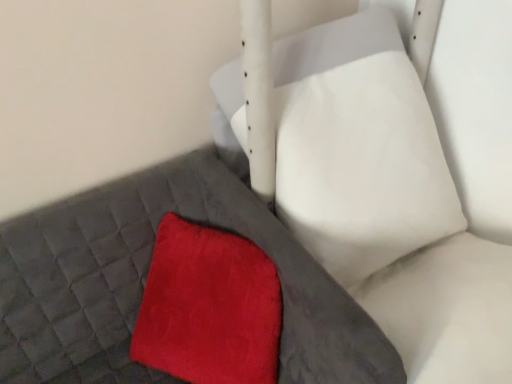
Question: Looking at their shapes, would you say matte gray bed frame at lower left is wider or thinner than velvet red cushion at center?

Choices:
 (A) wide
 (B) thin

Answer: (B)

Question: Based on their positions, is matte gray bed frame at lower left located to the left or right of velvet red cushion at center?

Choices:
 (A) right
 (B) left

Answer: (B)

Question: Considering the real-world distances, which object is farthest from the matte gray bed frame at lower left?

Choices:
 (A) velvety red throw pillow at center
 (B) velvet red cushion at center

Answer: (B)

Question: Which of these objects is positioned farthest from the velvety red throw pillow at center?

Choices:
 (A) matte gray bed frame at lower left
 (B) velvet red cushion at center

Answer: (B)